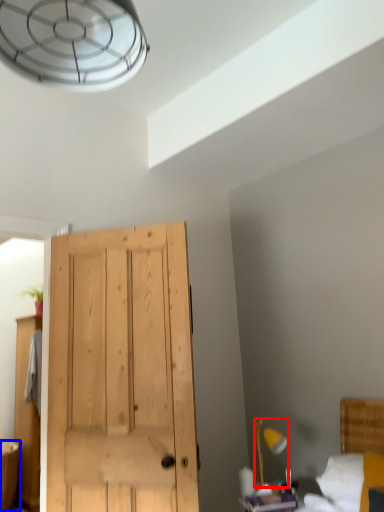
Question: Which point is further to the camera, light fixture (highlighted by a red box) or vanity (highlighted by a blue box)?

Choices:
 (A) light fixture
 (B) vanity

Answer: (B)